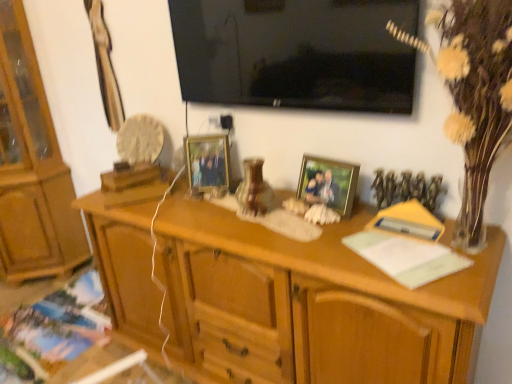
Image resolution: width=512 pixels, height=384 pixels. What are the coordinates of `empty space that is ontop of wooden desk at center (from a real-world perspective)` in the screenshot? It's located at (286, 226).